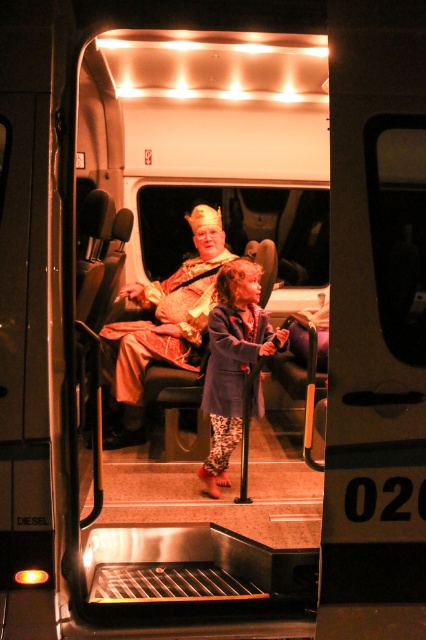
You are a passenger entering the vehicle and need to place a small bag on the seat. The seat has a coordinate system where the bottom left corner is the origin. The gold metallic crown at center is at position 0.506, 0.385. Where should you place your bag to avoid the crown?

Place the bag away from the coordinates (164, 323) where the gold metallic crown at center is located to avoid it.

You are a photographer inside the vehicle and want to take a photo of both the gold metallic crown at center and the blue denim jacket at center. Since the crown is larger, where should you position the camera to ensure both objects are in focus and properly framed?

To ensure both the gold metallic crown at center and the blue denim jacket at center are in focus and properly framed, position the camera at a distance where the larger gold metallic crown at center and the smaller blue denim jacket at center are both within the camera frame. Since the crown is larger, you might need to adjust the camera angle slightly to include both objects without cropping either.

You are a photographer inside the vehicle and want to capture both the gold metallic crown at center and the blue denim jacket at center in the same frame. Which object should you focus on first if you want to ensure both are in focus, considering their heights?

The gold metallic crown at center is taller than the blue denim jacket at center. To ensure both are in focus, focus on the gold metallic crown at center since it is the taller object.